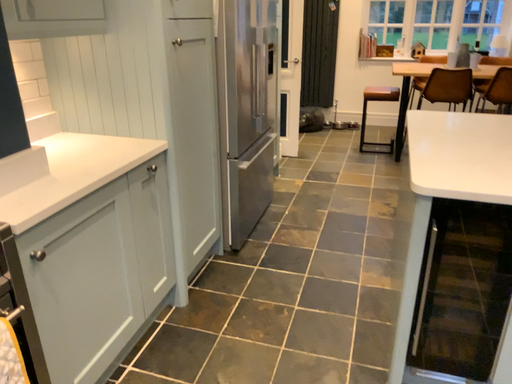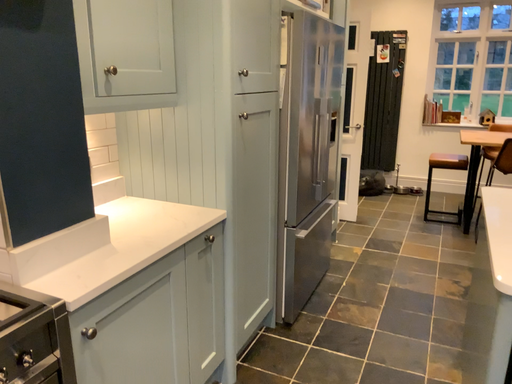
Question: Which way did the camera rotate in the video?

Choices:
 (A) rotated right
 (B) rotated left

Answer: (B)